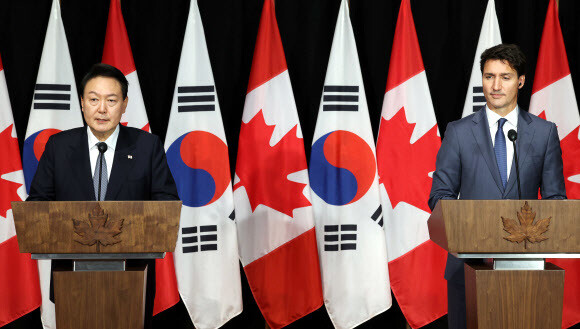
Identify the location of brown podium. Image resolution: width=580 pixels, height=329 pixels. (466, 231), (487, 276), (142, 220), (110, 292).